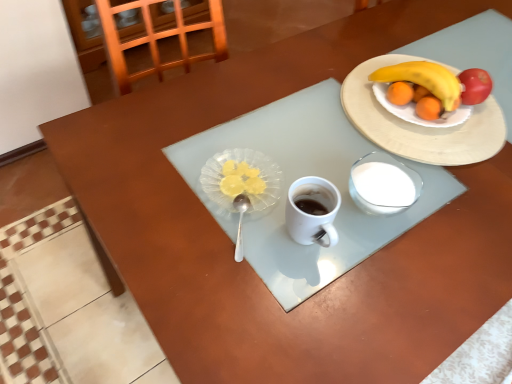
Find the location of a particular element. vacant space situated on the left part of white ceramic plate at upper right is located at coordinates (282, 99).